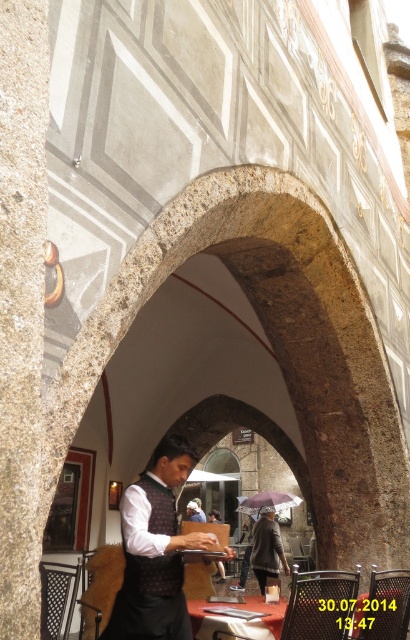
What do you see at coordinates (319, 604) in the screenshot? The width and height of the screenshot is (410, 640). I see `metallic mesh chair at center` at bounding box center [319, 604].

Between metallic mesh chair at center and metal mesh chair at lower right, which one appears on the left side from the viewer's perspective?

Positioned to the left is metal mesh chair at lower right.

Is point (325, 593) in front of point (357, 598)?

Yes, point (325, 593) is in front of point (357, 598).

The width and height of the screenshot is (410, 640). Identify the location of metallic mesh chair at center. (319, 604).

You are a GUI agent. You are given a task and a screenshot of the screen. Output one action in this format:
    pyautogui.click(x=<x>, y=<y>)
    Task: Click on the metallic mesh chair at center
    
    Given the screenshot: What is the action you would take?
    pyautogui.click(x=319, y=604)

Who is taller, metallic mesh chair at center or blue denim shirt at center?

With more height is metallic mesh chair at center.

Is point (353, 584) more distant than point (191, 518)?

No.

The height and width of the screenshot is (640, 410). I want to click on metallic mesh chair at center, so click(x=319, y=604).

Does metal mesh chair at lower left appear on the right side of wooden table at center?

Incorrect, metal mesh chair at lower left is not on the right side of wooden table at center.

Is point (47, 618) positioned in front of point (198, 621)?

Yes, point (47, 618) is closer to viewer.

Locate an element on the screen. metal mesh chair at lower left is located at coordinates (56, 596).

Find the location of a particular element. The height and width of the screenshot is (640, 410). metal mesh chair at lower left is located at coordinates (56, 596).